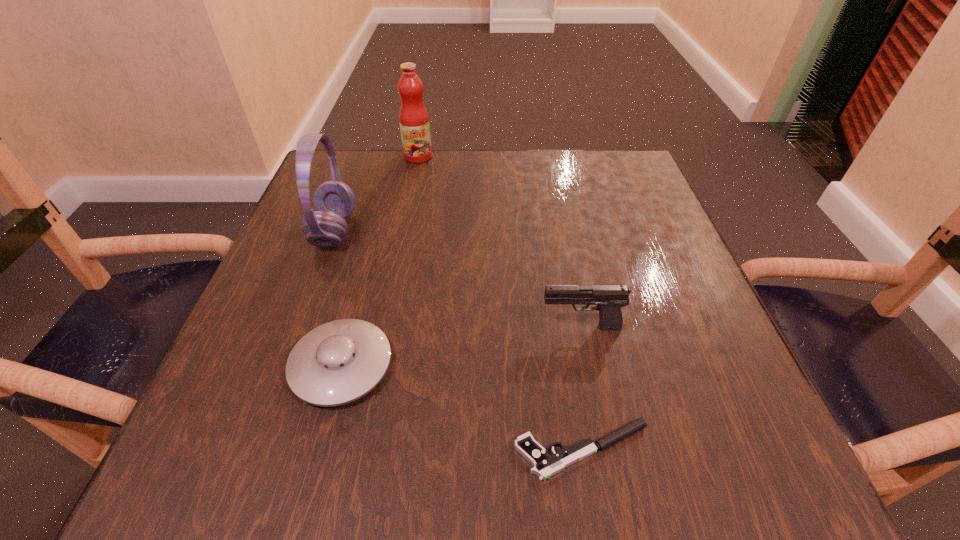
Image resolution: width=960 pixels, height=540 pixels. I want to click on saucer that is at the left edge, so click(338, 362).

Locate an element on the screen. The height and width of the screenshot is (540, 960). object located at the far left corner is located at coordinates (334, 201).

Locate an element on the screen. This screenshot has width=960, height=540. object that is at the near right corner is located at coordinates (545, 466).

Locate an element on the screen. The width and height of the screenshot is (960, 540). free space at the far edge of the desktop is located at coordinates (483, 188).

You are a GUI agent. You are given a task and a screenshot of the screen. Output one action in this format:
    pyautogui.click(x=<x>, y=<y>)
    Task: Click on the vacant region at the near edge
    This screenshot has height=540, width=960.
    Given the screenshot: What is the action you would take?
    pyautogui.click(x=540, y=438)

This screenshot has width=960, height=540. In the image, there is a desktop. In order to click on vacant area at the left edge in this screenshot , I will do `click(316, 281)`.

Identify the location of vacant region at the right edge. Image resolution: width=960 pixels, height=540 pixels. (637, 372).

Locate an element on the screen. The width and height of the screenshot is (960, 540). blank area at the far left corner is located at coordinates (366, 191).

The width and height of the screenshot is (960, 540). In the image, there is a desktop. What are the coordinates of `vacant space at the near left corner` in the screenshot? It's located at (229, 465).

At what (x,y) coordinates should I click in order to perform the action: click on blank space at the far right corner of the desktop. Please return your answer as a coordinate pair (x, y). The image size is (960, 540). Looking at the image, I should click on (585, 185).